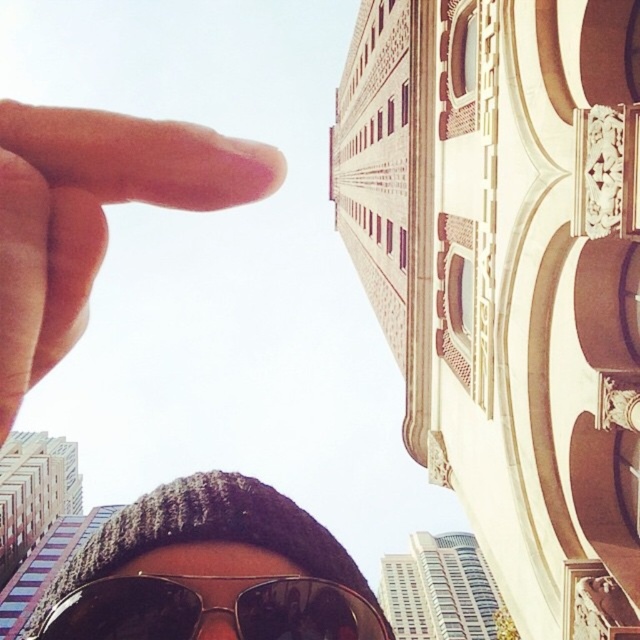
Question: Among these points, which one is farthest from the camera?

Choices:
 (A) (256, 577)
 (B) (182, 483)

Answer: (B)

Question: Which point is closer to the camera?

Choices:
 (A) knitted wool hat at center
 (B) pale skin finger at upper left
 (C) sunglasses at center

Answer: (B)

Question: Can you confirm if pale skin finger at upper left is thinner than sunglasses at center?

Choices:
 (A) yes
 (B) no

Answer: (A)

Question: Does pale skin finger at upper left appear over sunglasses at center?

Choices:
 (A) no
 (B) yes

Answer: (B)

Question: Which object is the closest to the sunglasses at center?

Choices:
 (A) pale skin finger at upper left
 (B) knitted wool hat at center

Answer: (B)

Question: Observing the image, what is the correct spatial positioning of knitted wool hat at center in reference to pale skin finger at upper left?

Choices:
 (A) above
 (B) below

Answer: (B)